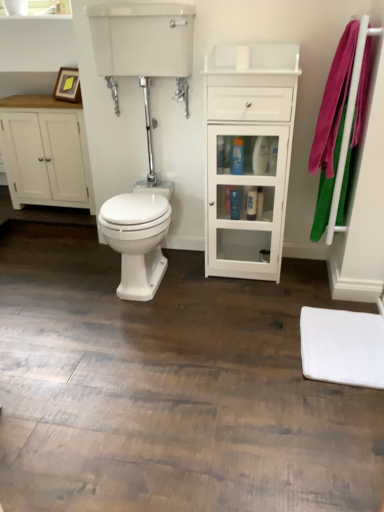
Where is `vacant space that is in between white glossy bidet at center and white matte mat at lower right`? Image resolution: width=384 pixels, height=512 pixels. vacant space that is in between white glossy bidet at center and white matte mat at lower right is located at coordinates (231, 313).